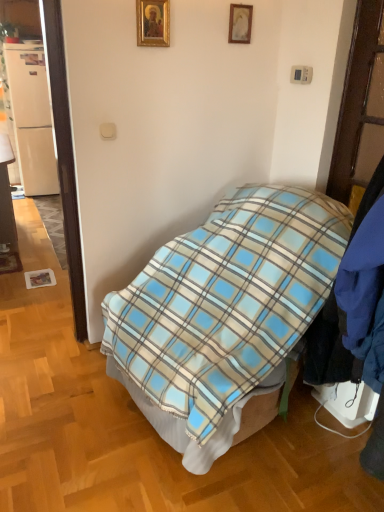
The image size is (384, 512). What do you see at coordinates (65, 158) in the screenshot?
I see `white glossy door at left` at bounding box center [65, 158].

The width and height of the screenshot is (384, 512). What are the coordinates of `blue plaid blanket at center` in the screenshot? It's located at (223, 313).

Measure the distance between wooden picture frame at upper center, placed as the 1th picture frame when sorted from back to front, and camera.

wooden picture frame at upper center, placed as the 1th picture frame when sorted from back to front, is 6.78 feet from camera.

The height and width of the screenshot is (512, 384). Find the location of `white matte refrigerator at left`. white matte refrigerator at left is located at coordinates (31, 117).

The height and width of the screenshot is (512, 384). Find the location of `white glossy door at left`. white glossy door at left is located at coordinates (65, 158).

Can matte wood desk at left be found inside white glossy door at left?

No, matte wood desk at left is located outside of white glossy door at left.

Is white glossy door at left facing towards matte wood desk at left?

No, white glossy door at left is not oriented towards matte wood desk at left.

How distant is white glossy door at left from matte wood desk at left?

white glossy door at left is 1.38 meters from matte wood desk at left.

How many degrees apart are the facing directions of white glossy door at left and matte wood desk at left?

The angular difference between white glossy door at left and matte wood desk at left is 92.3 degrees.

Considering the positions of objects white matte refrigerator at left and gold-framed picture at upper center, the 1th picture frame in the left-to-right sequence, in the image provided, who is more to the right, white matte refrigerator at left or gold-framed picture at upper center, the 1th picture frame in the left-to-right sequence,?

gold-framed picture at upper center, the 1th picture frame in the left-to-right sequence.

At what (x,y) coordinates should I click in order to perform the action: click on the 2nd picture frame below when counting from the white matte refrigerator at left (from the image's perspective). Please return your answer as a coordinate pair (x, y). Looking at the image, I should click on (153, 23).

Between white matte refrigerator at left and gold-framed picture at upper center, acting as the 2th picture frame starting from the back, which one has smaller size?

gold-framed picture at upper center, acting as the 2th picture frame starting from the back.

Is white matte refrigerator at left in front of or behind gold-framed picture at upper center, acting as the 2th picture frame starting from the back, in the image?

white matte refrigerator at left is positioned farther from the viewer than gold-framed picture at upper center, acting as the 2th picture frame starting from the back.

Would you say white matte refrigerator at left is to the left or to the right of blue plaid blanket at center in the picture?

white matte refrigerator at left is positioned on blue plaid blanket at center's left side.

Is the position of white matte refrigerator at left less distant than that of blue plaid blanket at center?

No, it is behind blue plaid blanket at center.

Considering the points (43, 163) and (302, 228), which point is in front, point (43, 163) or point (302, 228)?

The point (302, 228) is more forward.

Considering the sizes of objects white glossy door at left and gold-framed picture at upper center, the 1th picture frame in the left-to-right sequence, in the image provided, who is thinner, white glossy door at left or gold-framed picture at upper center, the 1th picture frame in the left-to-right sequence,?

gold-framed picture at upper center, the 1th picture frame in the left-to-right sequence, is thinner.

Considering the points (62, 82) and (156, 6), which point is in front, point (62, 82) or point (156, 6)?

The point (156, 6) is more forward.

Which object is further away from the camera taking this photo, white glossy door at left or gold-framed picture at upper center, the 1th picture frame in the left-to-right sequence?

Positioned behind is gold-framed picture at upper center, the 1th picture frame in the left-to-right sequence.

Can you confirm if white glossy door at left is positioned to the left of gold-framed picture at upper center, the 1th picture frame in the left-to-right sequence?

Yes, white glossy door at left is to the left of gold-framed picture at upper center, the 1th picture frame in the left-to-right sequence.

Who is taller, gold-framed picture at upper center, which is the first picture frame from front to back, or wooden picture frame at upper center, the 2th picture frame positioned from the left?

gold-framed picture at upper center, which is the first picture frame from front to back.

Can wooden picture frame at upper center, marked as the 2th picture frame in a front-to-back arrangement, be found inside gold-framed picture at upper center, which is the first picture frame from front to back?

No, wooden picture frame at upper center, marked as the 2th picture frame in a front-to-back arrangement, is not surrounded by gold-framed picture at upper center, which is the first picture frame from front to back.

Which is closer to the camera, (161, 1) or (243, 6)?

Point (161, 1) is closer to the camera than point (243, 6).

Can you confirm if gold-framed picture at upper center, the 2th picture frame in the right-to-left sequence, is smaller than wooden picture frame at upper center, marked as the 2th picture frame in a front-to-back arrangement?

Incorrect, gold-framed picture at upper center, the 2th picture frame in the right-to-left sequence, is not smaller in size than wooden picture frame at upper center, marked as the 2th picture frame in a front-to-back arrangement.

Is blue plaid blanket at center positioned beyond the bounds of white matte refrigerator at left?

Indeed, blue plaid blanket at center is completely outside white matte refrigerator at left.

Considering the relative sizes of blue plaid blanket at center and white matte refrigerator at left in the image provided, is blue plaid blanket at center thinner than white matte refrigerator at left?

No, blue plaid blanket at center is not thinner than white matte refrigerator at left.

In the scene shown: Which of these two, blue plaid blanket at center or white matte refrigerator at left, stands shorter?

blue plaid blanket at center.

From the image's perspective, relative to white matte refrigerator at left, is blue plaid blanket at center above or below?

Clearly, from the image's perspective, blue plaid blanket at center is below white matte refrigerator at left.

Based on the photo, is white matte refrigerator at left directly adjacent to white glossy door at left?

They are not placed beside each other.

Would you say white matte refrigerator at left is to the left or to the right of white glossy door at left in the picture?

In the image, white matte refrigerator at left appears on the left side of white glossy door at left.

From the picture: Considering the positions of objects white matte refrigerator at left and white glossy door at left in the image provided, who is in front, white matte refrigerator at left or white glossy door at left?

white glossy door at left is in front.

Locate an element on the screen. desk directly beneath the white glossy door at left (from a real-world perspective) is located at coordinates (7, 213).

You are a GUI agent. You are given a task and a screenshot of the screen. Output one action in this format:
    pyautogui.click(x=<x>, y=<y>)
    Task: Click on the refrigerator lying behind the gold-framed picture at upper center, acting as the 2th picture frame starting from the back
    
    Given the screenshot: What is the action you would take?
    pyautogui.click(x=31, y=117)

Considering their positions, is wooden picture frame at upper center, the 2th picture frame positioned from the left, positioned further to blue plaid blanket at center than gold-framed picture at upper center, acting as the 2th picture frame starting from the back?

wooden picture frame at upper center, the 2th picture frame positioned from the left, is further to blue plaid blanket at center.

Considering their positions, is matte wood desk at left positioned closer to white matte refrigerator at left than white glossy door at left?

matte wood desk at left is positioned closer to the anchor white matte refrigerator at left.

Based on their spatial positions, is white glossy door at left or wooden picture frame at upper center, placed as the 1th picture frame when sorted from back to front, further from gold-framed picture at upper center, acting as the 2th picture frame starting from the back?

white glossy door at left is further to gold-framed picture at upper center, acting as the 2th picture frame starting from the back.

Which object lies further to the anchor point white matte refrigerator at left, blue plaid blanket at center or wooden picture frame at upper center, marked as the 2th picture frame in a front-to-back arrangement?

blue plaid blanket at center.

Based on their spatial positions, is blue plaid blanket at center or gold-framed picture at upper center, acting as the 2th picture frame starting from the back, further from wooden picture frame at upper center, placed as the 1th picture frame when sorted from back to front?

Among the two, blue plaid blanket at center is located further to wooden picture frame at upper center, placed as the 1th picture frame when sorted from back to front.

Which object lies further to the anchor point gold-framed picture at upper center, the 2th picture frame in the right-to-left sequence, blue plaid blanket at center or white glossy door at left?

blue plaid blanket at center is positioned further to the anchor gold-framed picture at upper center, the 2th picture frame in the right-to-left sequence.

Estimate the real-world distances between objects in this image. Which object is closer to white matte refrigerator at left, gold-framed picture at upper center, the 1th picture frame in the left-to-right sequence, or blue plaid blanket at center?

Based on the image, gold-framed picture at upper center, the 1th picture frame in the left-to-right sequence, appears to be nearer to white matte refrigerator at left.

From the image, which object appears to be nearer to white matte refrigerator at left, gold-framed picture at upper center, which is the first picture frame from front to back, or wooden picture frame at upper center, marked as the 2th picture frame in a front-to-back arrangement?

Among the two, gold-framed picture at upper center, which is the first picture frame from front to back, is located nearer to white matte refrigerator at left.

Where is `door between matte wood desk at left and gold-framed picture at upper center, acting as the 2th picture frame starting from the back, in the horizontal direction`? This screenshot has width=384, height=512. door between matte wood desk at left and gold-framed picture at upper center, acting as the 2th picture frame starting from the back, in the horizontal direction is located at coordinates (65, 158).

Where is `picture frame between matte wood desk at left and blue plaid blanket at center from left to right`? Image resolution: width=384 pixels, height=512 pixels. picture frame between matte wood desk at left and blue plaid blanket at center from left to right is located at coordinates (153, 23).

You are a GUI agent. You are given a task and a screenshot of the screen. Output one action in this format:
    pyautogui.click(x=<x>, y=<y>)
    Task: Click on the door between gold-framed picture at upper center, acting as the 2th picture frame starting from the back, and blue plaid blanket at center, in the vertical direction
    
    Given the screenshot: What is the action you would take?
    pyautogui.click(x=65, y=158)

The height and width of the screenshot is (512, 384). I want to click on picture frame between gold-framed picture at upper center, the 1th picture frame in the left-to-right sequence, and white matte refrigerator at left in the front-back direction, so click(240, 23).